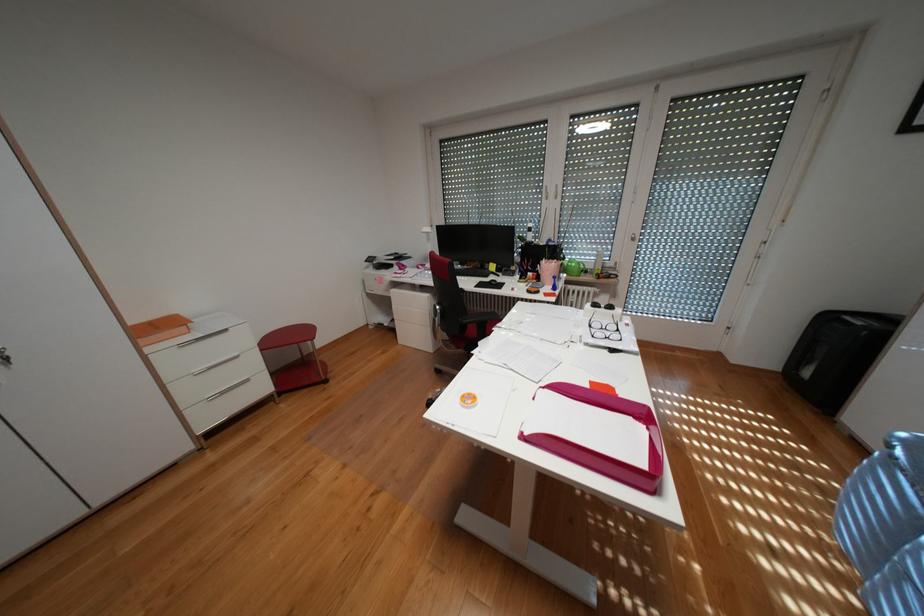
Find the location of a particular element. The width and height of the screenshot is (924, 616). red chair sitting surface is located at coordinates (295, 358).